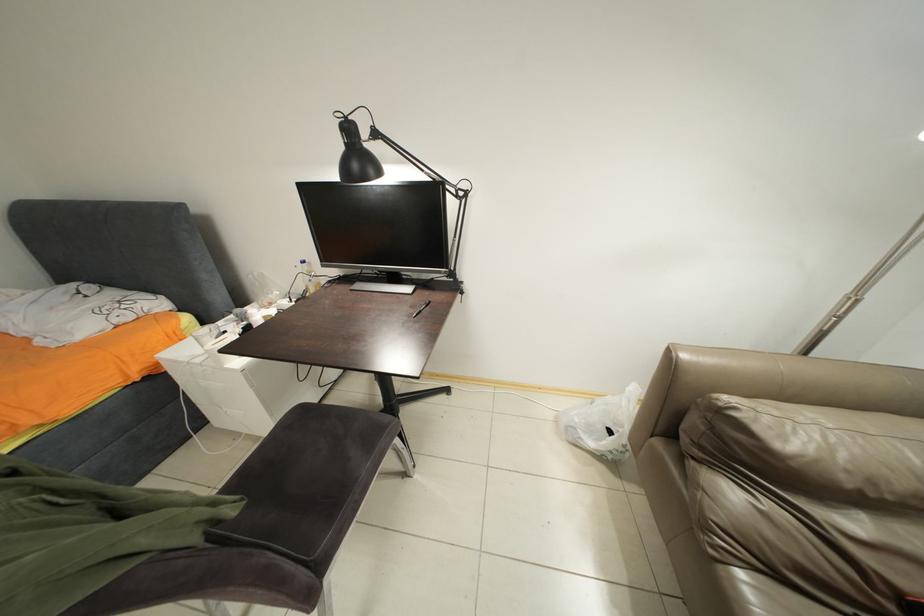
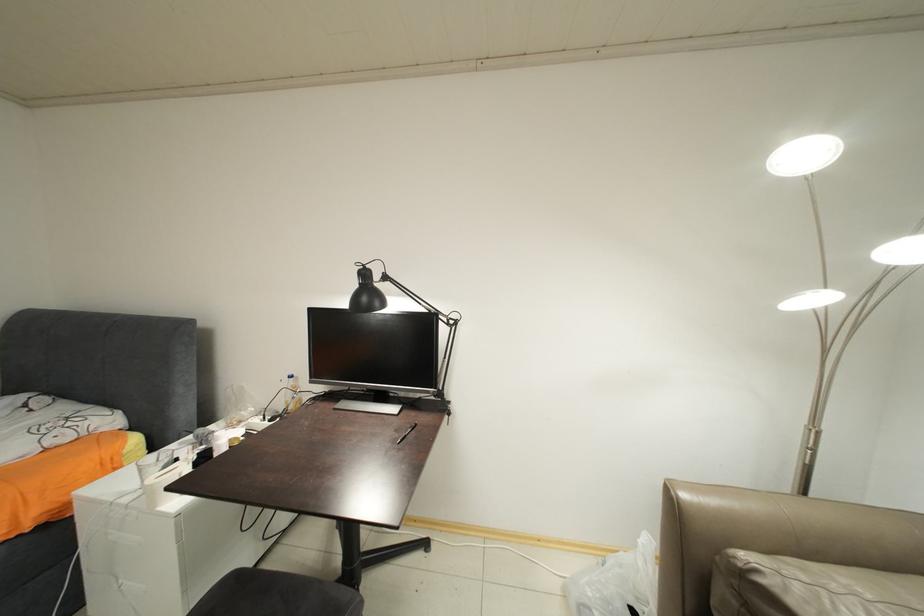
Question: The first image is from the beginning of the video and the second image is from the end. How did the camera likely rotate when shooting the video?

Choices:
 (A) Left
 (B) Right
 (C) Up
 (D) Down

Answer: (C)